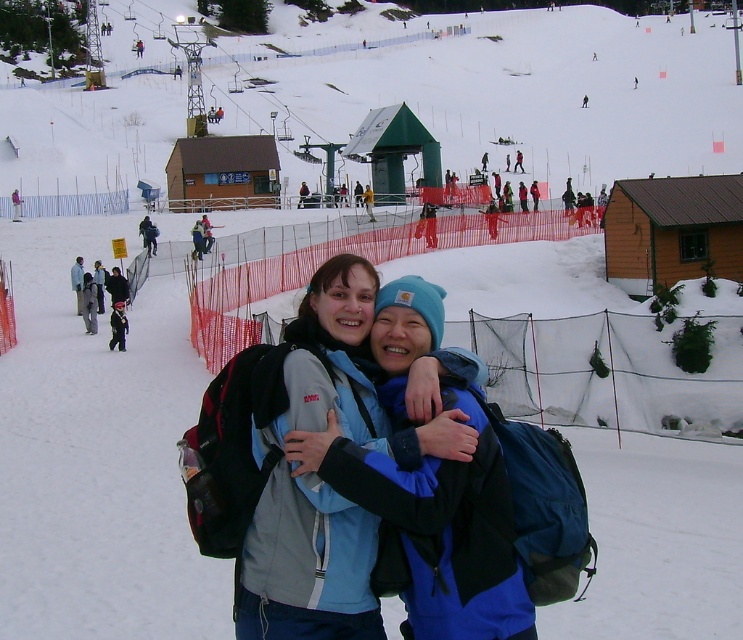
You are a photographer standing at the ski resort. You want to take a photo of both the blue fabric jacket at center and the dark blue jacket at center. However, you notice that one is blocking the other. Which jacket is currently blocking the other?

The blue fabric jacket at center is blocking the dark blue jacket at center because it is positioned in front of it.

You are standing at the point labeled point [120,316] and want to move to the point labeled point [343,333]. Which direction should you move to get closer to the viewer?

To move closer to the viewer from point [120,316] to point [343,333], you should move upwards because point [343,333] is closer to the viewer than point [120,316] according to the coordinates provided.

What are the coordinates of the blue fabric jacket at center?

The blue fabric jacket at center is located at coordinates point (311,474).